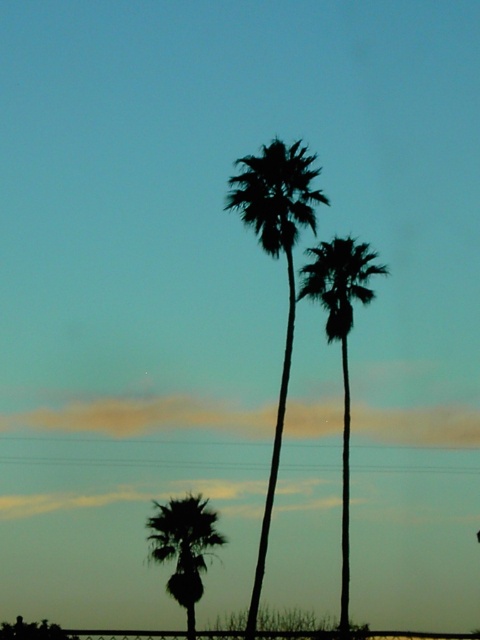
Is silhouette leafy palm at center thinner than silhouette palm at lower left?

No, silhouette leafy palm at center is not thinner than silhouette palm at lower left.

Who is positioned more to the left, silhouette leafy palm at center or silhouette palm at lower left?

From the viewer's perspective, silhouette palm at lower left appears more on the left side.

Where is `silhouette leafy palm at center`? The height and width of the screenshot is (640, 480). silhouette leafy palm at center is located at coordinates (287, 269).

Who is lower down, silhouette leafy palm at center or silhouette palm at center?

silhouette palm at center

Does silhouette leafy palm at center lie behind silhouette palm at center?

No, it is not.

Locate an element on the screen. This screenshot has height=640, width=480. silhouette leafy palm at center is located at coordinates (287, 269).

Can you confirm if silhouette palm at center is wider than silhouette palm at lower left?

Yes.

Who is more distant from viewer, (340, 579) or (177, 554)?

The point (177, 554) is behind.

The width and height of the screenshot is (480, 640). I want to click on silhouette palm at center, so click(x=340, y=344).